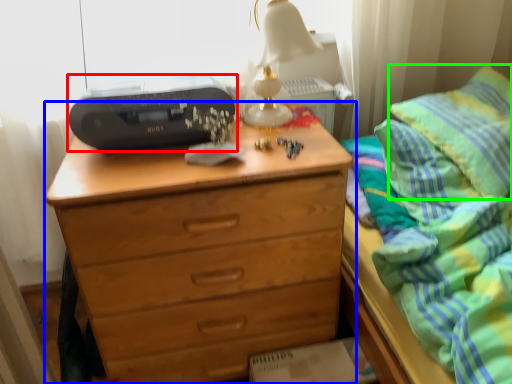
Question: Which object is the closest to the printer (highlighted by a red box)? Choose among these: chest of drawers (highlighted by a blue box) or pillow (highlighted by a green box).

Choices:
 (A) chest of drawers
 (B) pillow

Answer: (A)